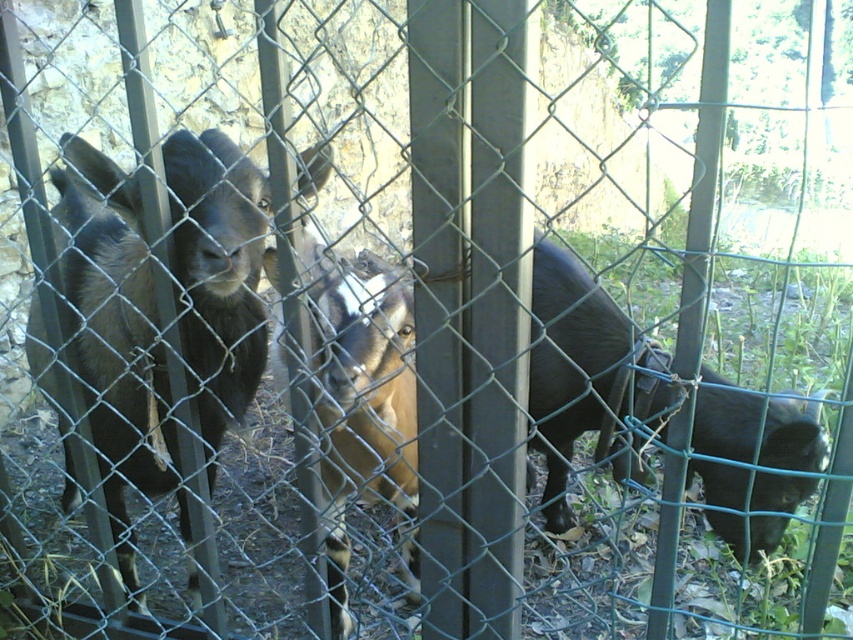
Between dark brown fur goat at left and brown fuzzy goat at center, which one appears on the left side from the viewer's perspective?

From the viewer's perspective, dark brown fur goat at left appears more on the left side.

Which is below, dark brown fur goat at left or brown fuzzy goat at center?

brown fuzzy goat at center

Is point (123, 326) in front of point (331, 544)?

Yes, it is.

I want to click on dark brown fur goat at left, so click(115, 339).